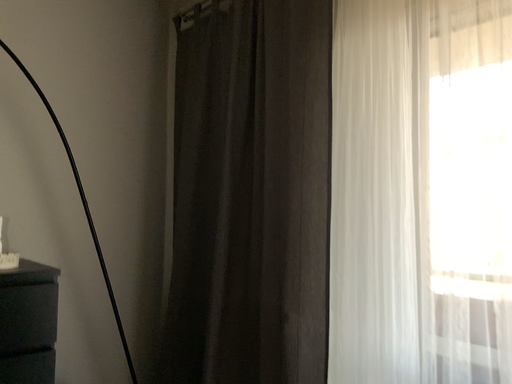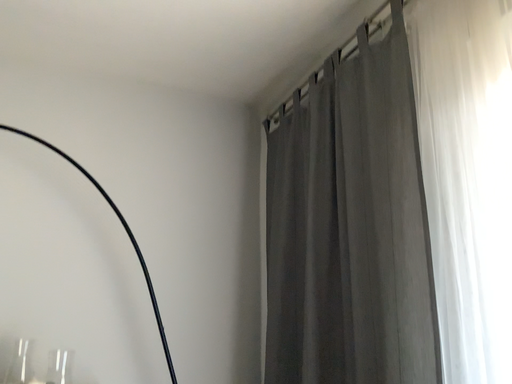
Question: How did the camera likely rotate when shooting the video?

Choices:
 (A) rotated right
 (B) rotated left

Answer: (B)